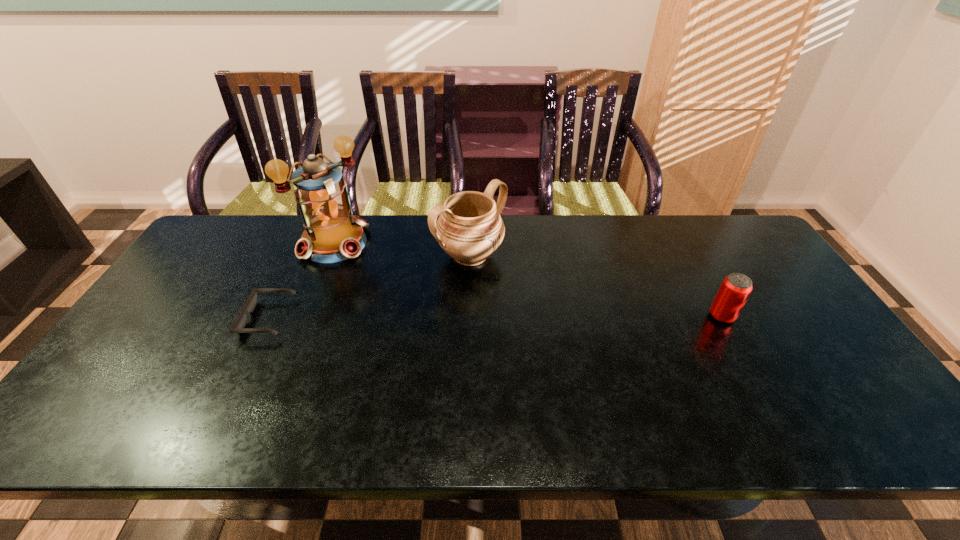
At what (x,y) coordinates should I click in order to perform the action: click on sunglasses. Please return your answer as a coordinate pair (x, y). This screenshot has width=960, height=540. Looking at the image, I should click on (238, 327).

You are a GUI agent. You are given a task and a screenshot of the screen. Output one action in this format:
    pyautogui.click(x=<x>, y=<y>)
    Task: Click on the rightmost object
    
    Given the screenshot: What is the action you would take?
    pyautogui.click(x=735, y=289)

I want to click on can, so click(735, 289).

Identify the location of the tallest object. The width and height of the screenshot is (960, 540). (332, 233).

Where is `the third object from left to right`? Image resolution: width=960 pixels, height=540 pixels. the third object from left to right is located at coordinates [469, 229].

The image size is (960, 540). Find the location of `urn`. urn is located at coordinates pos(469,229).

At what (x,y) coordinates should I click in order to perform the action: click on free space located 0.200m on the front-facing side of the shortest object. Please return your answer as a coordinate pair (x, y). This screenshot has height=540, width=960. Looking at the image, I should click on (174, 318).

Image resolution: width=960 pixels, height=540 pixels. In order to click on vacant space located on the front-facing side of the shortest object in this screenshot , I will do `click(214, 318)`.

I want to click on vacant area situated 0.170m on the front-facing side of the shortest object, so click(184, 318).

Locate an element on the screen. free space located 0.200m on the left of the rightmost object is located at coordinates (636, 316).